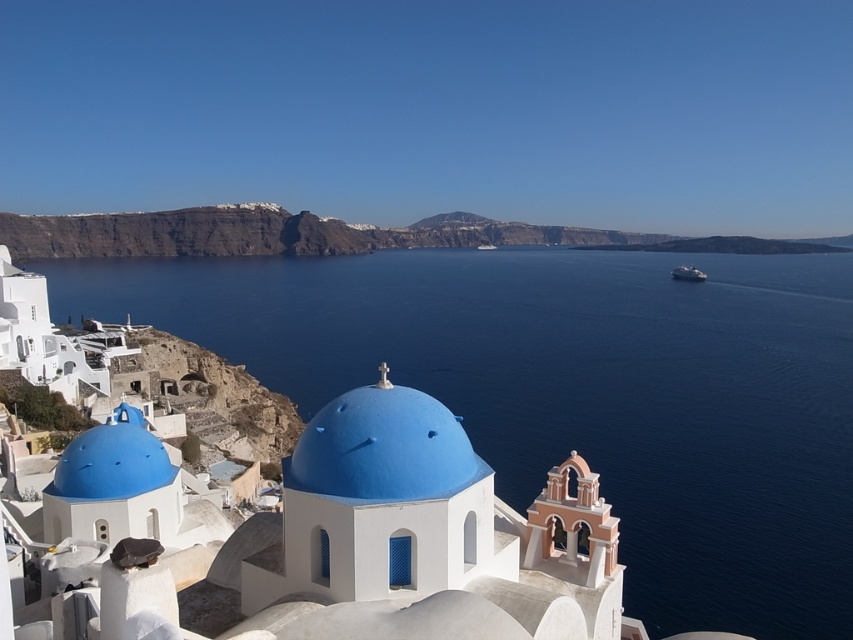
Can you confirm if blue matte dome at center is bigger than white glossy boat at center?

Incorrect, blue matte dome at center is not larger than white glossy boat at center.

Is point (317, 422) positioned after point (485, 243)?

No, it is in front of (485, 243).

The image size is (853, 640). What are the coordinates of `blue matte dome at center` in the screenshot? It's located at (381, 449).

Looking at this image, between blue liquid water at center and blue matte dome at center, which one is positioned higher?

blue liquid water at center is above.

Consider the image. Who is positioned more to the right, blue liquid water at center or blue matte dome at center?

blue matte dome at center is more to the right.

Find the location of a particular element. blue liquid water at center is located at coordinates (578, 392).

From the picture: Is matte blue dome at lower left positioned at the back of white glossy boat at center?

No.

Which of these two, matte blue dome at lower left or white glossy boat at center, stands shorter?

Standing shorter between the two is matte blue dome at lower left.

Image resolution: width=853 pixels, height=640 pixels. What do you see at coordinates (112, 460) in the screenshot?
I see `matte blue dome at lower left` at bounding box center [112, 460].

At what (x,y) coordinates should I click in order to perform the action: click on matte blue dome at lower left. Please return your answer as a coordinate pair (x, y). The height and width of the screenshot is (640, 853). Looking at the image, I should click on (112, 460).